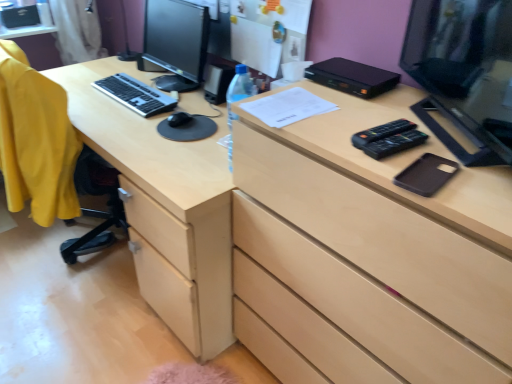
Locate an element on the screen. This screenshot has height=384, width=512. free point to the right of white paper at center is located at coordinates (356, 107).